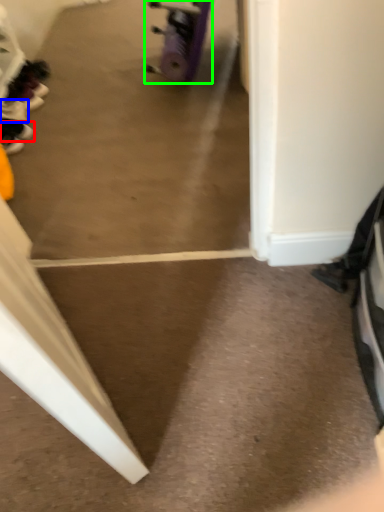
Question: Which object is positioned farthest from footwear (highlighted by a red box)? Select from footwear (highlighted by a blue box) and wheel (highlighted by a green box).

Choices:
 (A) footwear
 (B) wheel

Answer: (B)